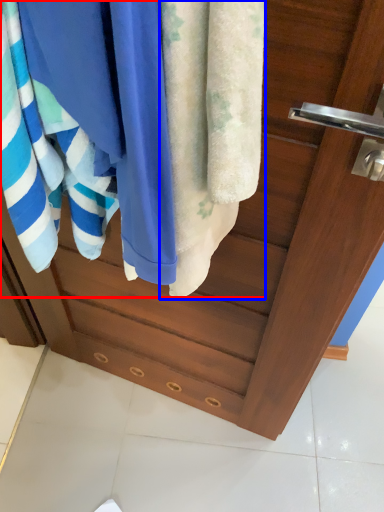
Question: Which object appears farthest to the camera in this image, beach towel (highlighted by a red box) or towel (highlighted by a blue box)?

Choices:
 (A) beach towel
 (B) towel

Answer: (A)